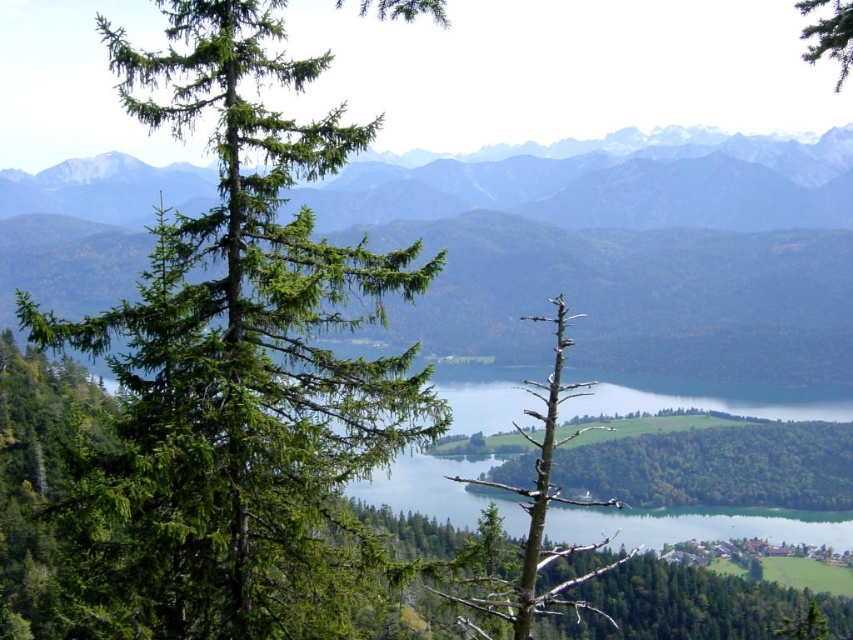
Question: Which point is farther to the camera?

Choices:
 (A) brown/dried wood tree at center
 (B) green matte tree at left
 (C) green needle-like tree at upper right

Answer: (C)

Question: Estimate the real-world distances between objects in this image. Which object is farther from the green needle-like tree at upper right?

Choices:
 (A) green leafy tree at center
 (B) brown/dried wood tree at center
 (C) green matte tree at left

Answer: (C)

Question: Can you confirm if green matte tree at left is thinner than green needle-like tree at upper right?

Choices:
 (A) yes
 (B) no

Answer: (A)

Question: Is the position of green matte tree at left less distant than that of brown/dried wood tree at center?

Choices:
 (A) yes
 (B) no

Answer: (B)

Question: Can you confirm if green matte tree at left is positioned to the right of green leafy tree at center?

Choices:
 (A) no
 (B) yes

Answer: (A)

Question: Based on their relative distances, which object is nearer to the green matte tree at left?

Choices:
 (A) brown/dried wood tree at center
 (B) green leafy tree at center

Answer: (A)